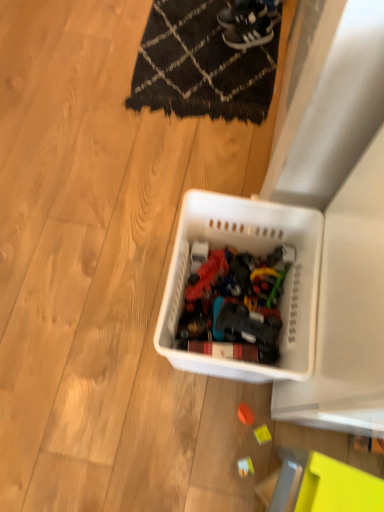
Find the location of `free space behind white leather sneakers at upper center, which is the second footwear from top to bottom`. free space behind white leather sneakers at upper center, which is the second footwear from top to bottom is located at coordinates (235, 13).